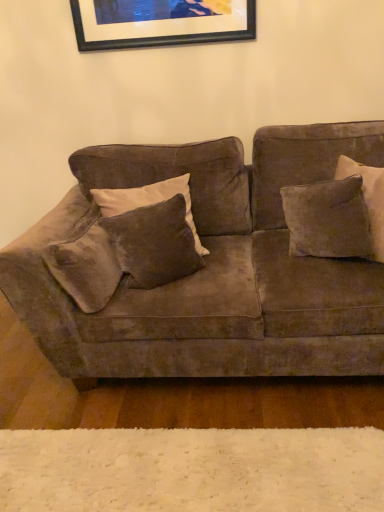
Question: Should I look upward or downward to see velvet brown pillow at right, which is the first pillow in right-to-left order?

Choices:
 (A) up
 (B) down

Answer: (A)

Question: Considering the relative positions of velvet brown pillow at right, which is the first pillow in right-to-left order, and velvet brown couch at center in the image provided, is velvet brown pillow at right, which is the first pillow in right-to-left order, to the left of velvet brown couch at center from the viewer's perspective?

Choices:
 (A) yes
 (B) no

Answer: (B)

Question: Does velvet brown pillow at right, which is the first pillow in right-to-left order, appear on the right side of velvet brown couch at center?

Choices:
 (A) yes
 (B) no

Answer: (A)

Question: From a real-world perspective, is velvet brown pillow at right, which is the first pillow in right-to-left order, physically above velvet brown couch at center?

Choices:
 (A) no
 (B) yes

Answer: (B)

Question: Does velvet brown pillow at right, which is the first pillow in right-to-left order, have a lesser height compared to velvet brown couch at center?

Choices:
 (A) yes
 (B) no

Answer: (A)

Question: From a real-world perspective, is velvet brown pillow at right, which is the first pillow in right-to-left order, under velvet brown couch at center?

Choices:
 (A) no
 (B) yes

Answer: (A)

Question: Is there a large distance between velvet brown pillow at right, the 2th pillow when ordered from left to right, and velvet brown couch at center?

Choices:
 (A) no
 (B) yes

Answer: (A)

Question: Is velvet brown pillow at right, the 2th pillow when ordered from left to right, positioned in front of black matte picture frame at upper center?

Choices:
 (A) no
 (B) yes

Answer: (B)

Question: Considering the relative sizes of velvet brown pillow at right, which is the first pillow in right-to-left order, and black matte picture frame at upper center in the image provided, is velvet brown pillow at right, which is the first pillow in right-to-left order, thinner than black matte picture frame at upper center?

Choices:
 (A) no
 (B) yes

Answer: (A)

Question: Could you tell me if velvet brown pillow at right, the 2th pillow when ordered from left to right, is facing black matte picture frame at upper center?

Choices:
 (A) no
 (B) yes

Answer: (A)

Question: From the image's perspective, would you say velvet brown pillow at right, which is the first pillow in right-to-left order, is positioned over black matte picture frame at upper center?

Choices:
 (A) no
 (B) yes

Answer: (A)

Question: Is velvet brown pillow at right, which is the first pillow in right-to-left order, facing away from black matte picture frame at upper center?

Choices:
 (A) yes
 (B) no

Answer: (B)

Question: Is velvet brown pillow at right, which is the first pillow in right-to-left order, shorter than black matte picture frame at upper center?

Choices:
 (A) no
 (B) yes

Answer: (A)

Question: From the image's perspective, is velvet brown pillow at center, positioned as the 2th pillow in right-to-left order, beneath velvet brown pillow at right, the 2th pillow when ordered from left to right?

Choices:
 (A) no
 (B) yes

Answer: (B)